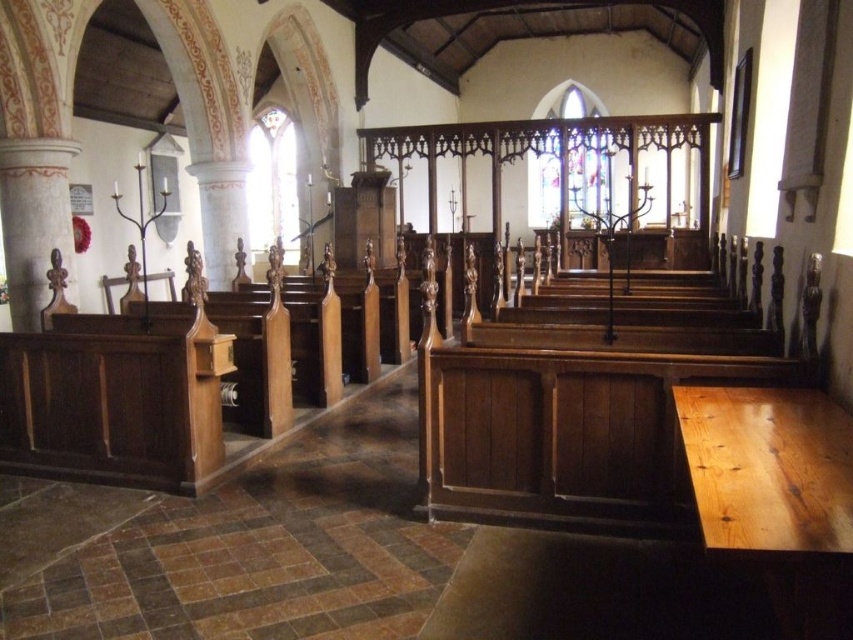
You are an architect visiting the church and want to compare the heights of the stained glass at center and the clear stained glass window at upper left. Which one is taller?

The clear stained glass window at upper left is taller than the stained glass at center.